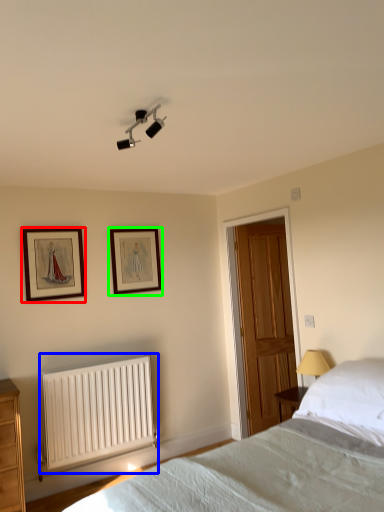
Question: Which object is the farthest from picture frame (highlighted by a red box)? Choose among these: radiator (highlighted by a blue box) or picture frame (highlighted by a green box).

Choices:
 (A) radiator
 (B) picture frame

Answer: (A)